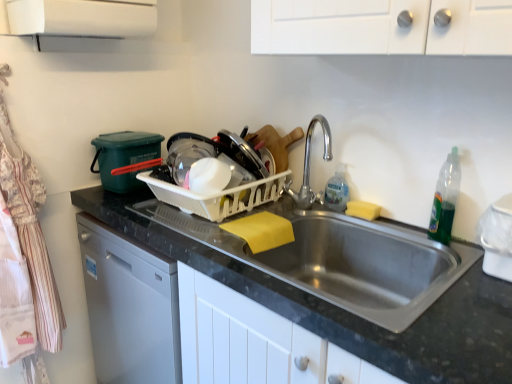
Question: Can we say white plastic basket at center lies outside striped cotton apron at left?

Choices:
 (A) no
 (B) yes

Answer: (B)

Question: From the image's perspective, is white plastic basket at center over striped cotton apron at left?

Choices:
 (A) yes
 (B) no

Answer: (A)

Question: Is white plastic basket at center behind striped cotton apron at left?

Choices:
 (A) no
 (B) yes

Answer: (B)

Question: Is white plastic basket at center turned away from striped cotton apron at left?

Choices:
 (A) yes
 (B) no

Answer: (B)

Question: Is white plastic basket at center aimed at striped cotton apron at left?

Choices:
 (A) yes
 (B) no

Answer: (B)

Question: From their relative heights in the image, would you say striped cotton apron at left is taller or shorter than clear plastic bottle at sink?

Choices:
 (A) tall
 (B) short

Answer: (A)

Question: Is striped cotton apron at left wider or thinner than clear plastic bottle at sink?

Choices:
 (A) thin
 (B) wide

Answer: (B)

Question: From a real-world perspective, is striped cotton apron at left above or below clear plastic bottle at sink?

Choices:
 (A) below
 (B) above

Answer: (A)

Question: Is point (19, 182) positioned closer to the camera than point (333, 188)?

Choices:
 (A) closer
 (B) farther

Answer: (A)

Question: Is point [x=450, y=362] positioned closer to the camera than point [x=329, y=178]?

Choices:
 (A) farther
 (B) closer

Answer: (B)

Question: Is black granite countertop at center taller or shorter than clear plastic bottle at sink?

Choices:
 (A) short
 (B) tall

Answer: (B)

Question: Which is correct: black granite countertop at center is inside clear plastic bottle at sink, or outside of it?

Choices:
 (A) inside
 (B) outside

Answer: (B)

Question: From a real-world perspective, is black granite countertop at center positioned above or below clear plastic bottle at sink?

Choices:
 (A) below
 (B) above

Answer: (A)

Question: Considering the positions of white plastic basket at center and green translucent bottle at right in the image, is white plastic basket at center wider or thinner than green translucent bottle at right?

Choices:
 (A) thin
 (B) wide

Answer: (B)

Question: In the image, is white plastic basket at center positioned in front of or behind green translucent bottle at right?

Choices:
 (A) behind
 (B) front

Answer: (A)